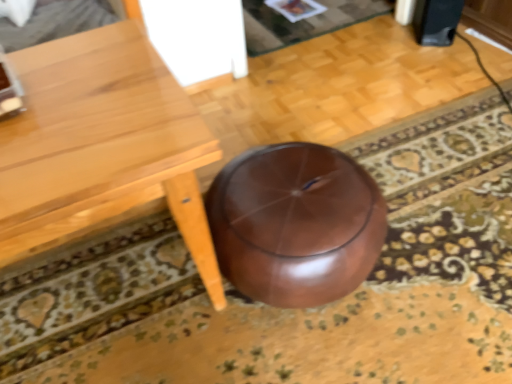
Question: Considering the positions of light brown wooden table at lower right and black matte speaker at upper right in the image, is light brown wooden table at lower right bigger or smaller than black matte speaker at upper right?

Choices:
 (A) small
 (B) big

Answer: (B)

Question: Considering their positions, is light brown wooden table at lower right located in front of or behind black matte speaker at upper right?

Choices:
 (A) behind
 (B) front

Answer: (B)

Question: In the image, is light brown wooden table at lower right on the left side or the right side of black matte speaker at upper right?

Choices:
 (A) left
 (B) right

Answer: (A)

Question: From their relative heights in the image, would you say black matte speaker at upper right is taller or shorter than light brown wooden table at lower right?

Choices:
 (A) short
 (B) tall

Answer: (A)

Question: Is black matte speaker at upper right wider or thinner than light brown wooden table at lower right?

Choices:
 (A) thin
 (B) wide

Answer: (A)

Question: Relative to light brown wooden table at lower right, is black matte speaker at upper right in front or behind?

Choices:
 (A) behind
 (B) front

Answer: (A)

Question: Visually, is black matte speaker at upper right positioned to the left or to the right of light brown wooden table at lower right?

Choices:
 (A) left
 (B) right

Answer: (B)